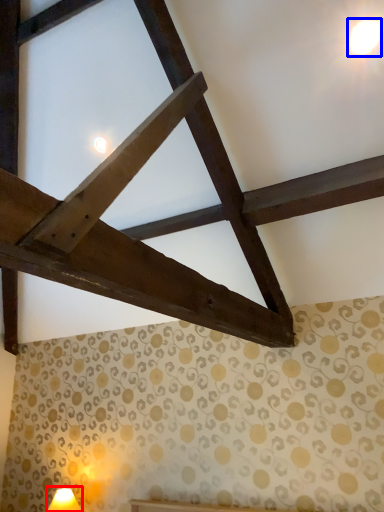
Question: Which of the following is the farthest to the observer, table lamp (highlighted by a red box) or light (highlighted by a blue box)?

Choices:
 (A) table lamp
 (B) light

Answer: (A)